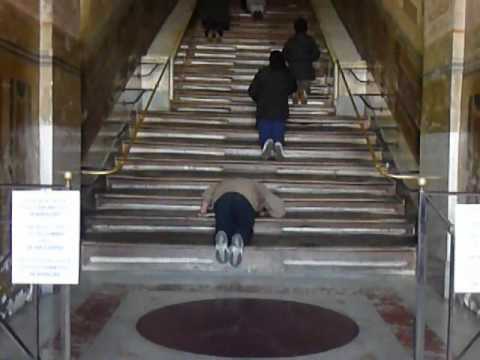
Find the location of a particular element. right wall is located at coordinates click(403, 29).